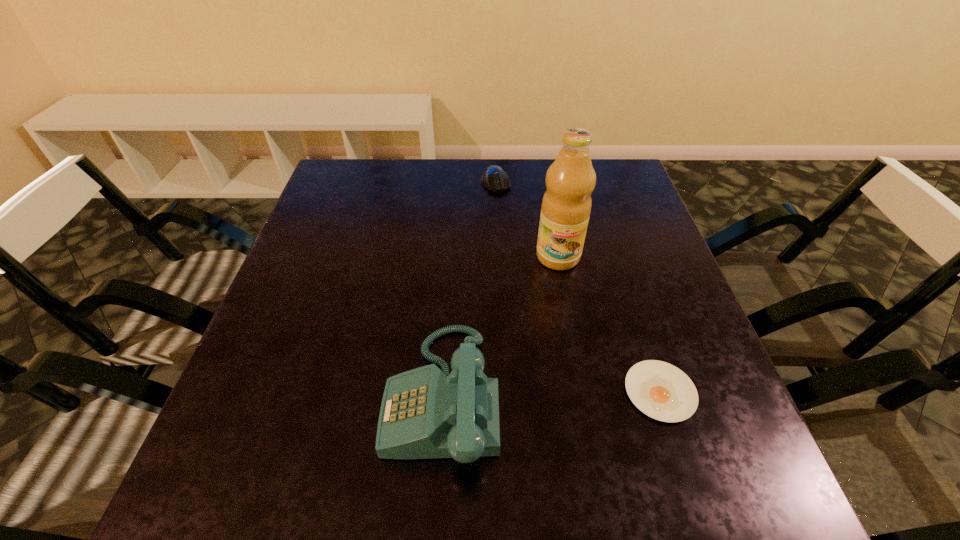
Identify the location of free region located 0.400m on the back of the shortest object. The image size is (960, 540). (608, 231).

Where is `vacant region located on the button side of the computer mouse`? vacant region located on the button side of the computer mouse is located at coordinates (517, 269).

At what (x,y) coordinates should I click in order to perform the action: click on vacant area located on the button side of the computer mouse. Please return your answer as a coordinate pair (x, y). The image size is (960, 540). Looking at the image, I should click on (525, 298).

Locate an element on the screen. Image resolution: width=960 pixels, height=540 pixels. free location located 0.110m on the button side of the computer mouse is located at coordinates (504, 217).

Find the location of a particular element. The width and height of the screenshot is (960, 540). free location located on the label of the tallest object is located at coordinates (560, 420).

The height and width of the screenshot is (540, 960). In order to click on free spot located 0.120m on the label of the tallest object in this screenshot , I will do `click(559, 311)`.

You are a GUI agent. You are given a task and a screenshot of the screen. Output one action in this format:
    pyautogui.click(x=<x>, y=<y>)
    Task: Click on the free location located on the label of the tallest object
    Image resolution: width=960 pixels, height=540 pixels.
    Given the screenshot: What is the action you would take?
    pyautogui.click(x=559, y=311)

This screenshot has width=960, height=540. What are the coordinates of `object that is at the far edge` in the screenshot? It's located at (494, 178).

Locate an element on the screen. The image size is (960, 540). telephone that is at the near edge is located at coordinates point(425,413).

The image size is (960, 540). What are the coordinates of `egg yolk situated at the near edge` in the screenshot? It's located at (660, 390).